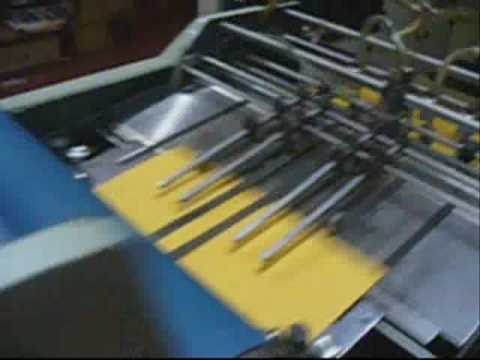
Where is `rod`? rod is located at coordinates (440, 165).